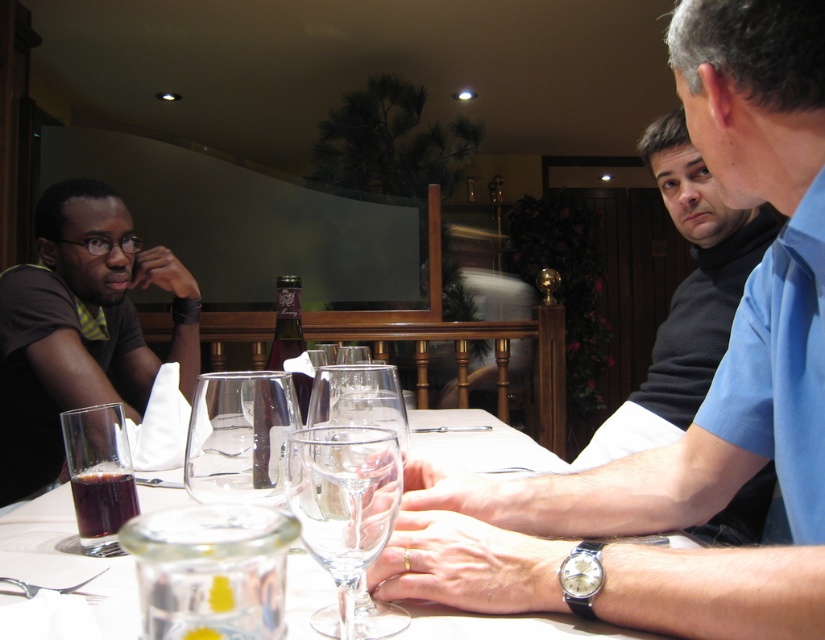
You are a server in a restaurant and need to place a new drink order on the table. The table has a matte black shirt at left and a translucent glass at lower left. Which item should you avoid placing the drink near to prevent it from tipping over?

You should avoid placing the drink near the translucent glass at lower left because the matte black shirt at left is taller and could provide better stability, whereas the shorter translucent glass at lower left might not offer the same level of support.

You are a server in a restaurant and need to place a new order on the table. The table has a matte black shirt at left and a translucent glass at lower left. Which item should you avoid placing the hot dish next to to prevent damage?

You should avoid placing the hot dish next to the translucent glass at lower left because the matte black shirt at left is wider and can provide a safer space away from the glass.